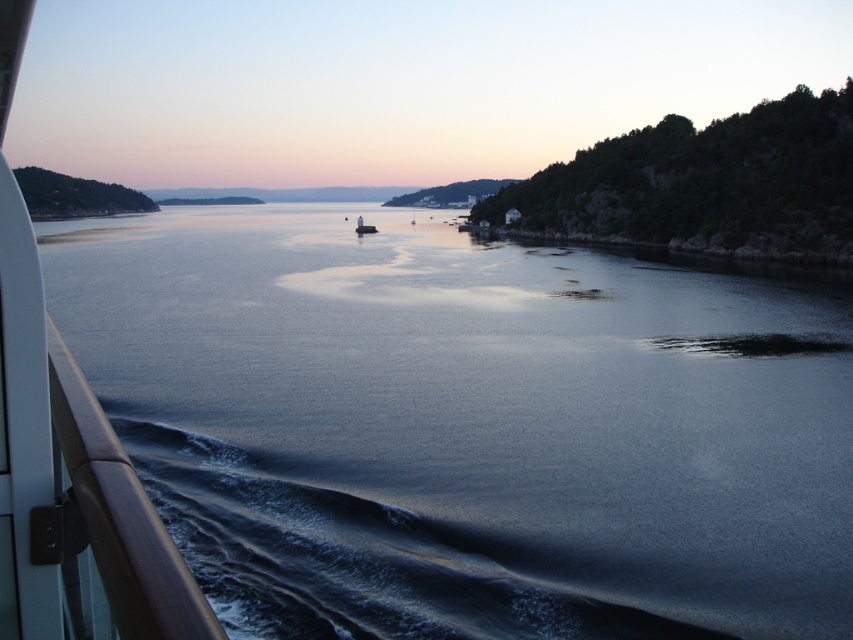
You are a photographer wanting to capture the white glossy lighthouse at center and the brown polished wood boat at left in the same frame. Based on their positions, which object would appear closer to the bottom of the photo?

The brown polished wood boat at left is below the white glossy lighthouse at center, so it would appear closer to the bottom of the photo.

You are standing at the point with coordinates point at (68, 461). Looking at the scene, what object is located at this coordinate?

The point at (68, 461) corresponds to the brown polished wood boat at left.

You are standing on the beach and want to walk from the brown polished wood boat at left to the white glossy lighthouse at center. Which direction should you head towards?

Since the brown polished wood boat at left is closer to the viewer than the white glossy lighthouse at center, you should head towards the right to reach the lighthouse.